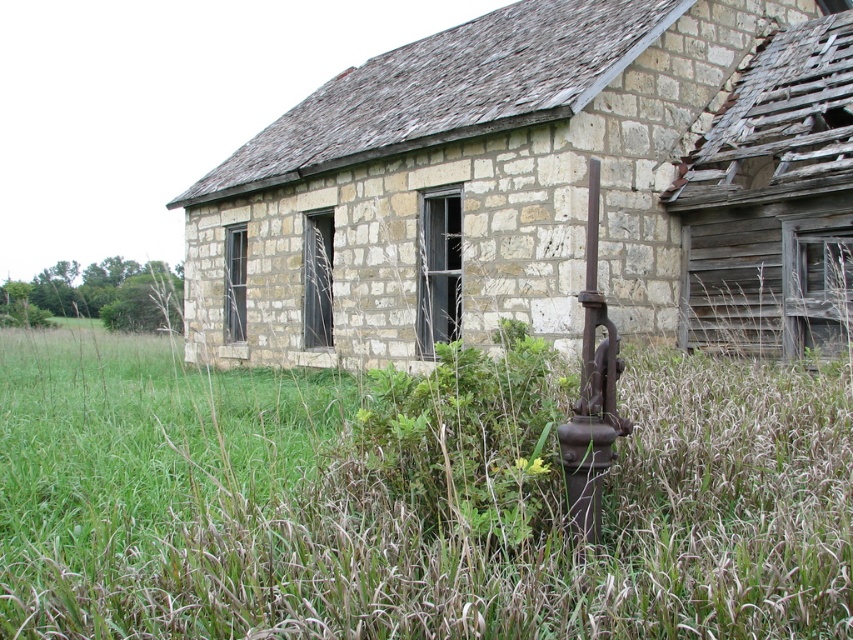
You are standing at the center of the image and want to move towards the green grass at lower left. Based on the coordinates provided in the Objects Description, in which direction should you move?

The green grass at lower left is located at point [412,499], which means you should move towards the lower left direction to reach it.

You are standing in the field near the old stone building and want to walk towards the stone wall at center. Which direction should you move relative to the green grass at lower left?

Since the green grass at lower left has a lesser height compared to the stone wall at center, you should move towards the center from the lower left area where the grass is shorter, heading directly toward the stone wall at center.